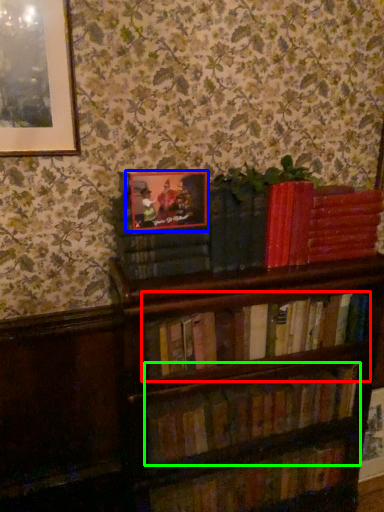
Question: Considering the real-world distances, which object is farthest from book (highlighted by a red box)? picture frame (highlighted by a blue box) or book (highlighted by a green box)?

Choices:
 (A) picture frame
 (B) book

Answer: (A)